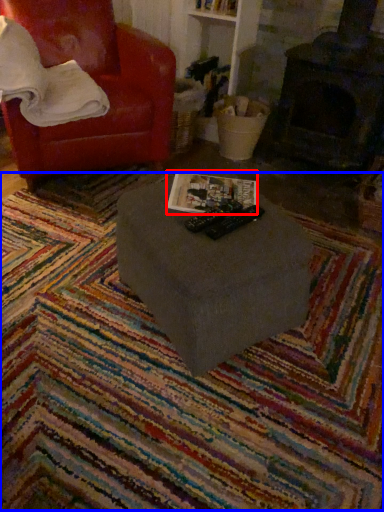
Question: Which object is closer to the camera taking this photo, magazine (highlighted by a red box) or mat (highlighted by a blue box)?

Choices:
 (A) magazine
 (B) mat

Answer: (B)